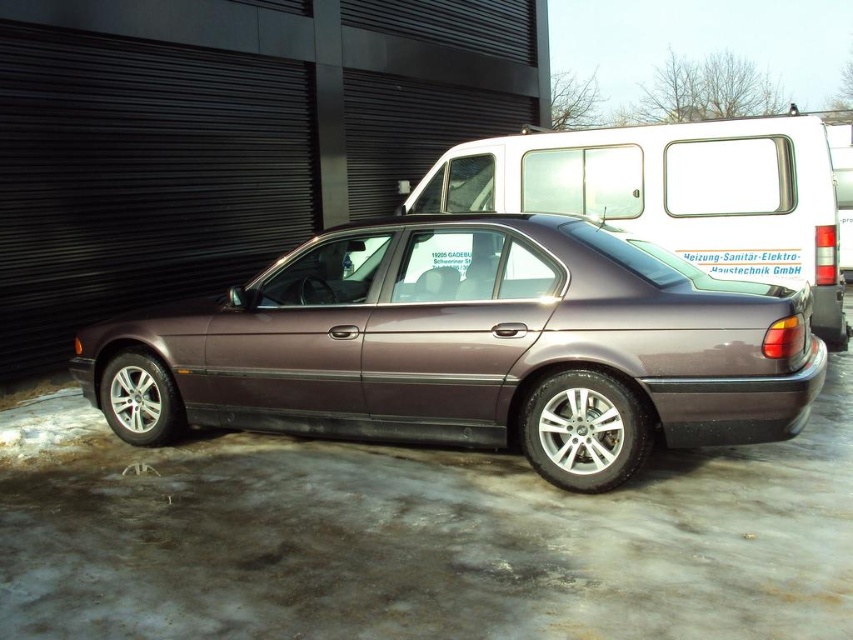
Question: Does satin metallic car at center appear on the left side of metallic silver van at center?

Choices:
 (A) no
 (B) yes

Answer: (B)

Question: Which of the following is the farthest from the observer?

Choices:
 (A) (466, 300)
 (B) (795, 214)

Answer: (B)

Question: Among these points, which one is farthest from the camera?

Choices:
 (A) (672, 164)
 (B) (587, 465)

Answer: (A)

Question: Is satin metallic car at center wider than metallic silver van at center?

Choices:
 (A) no
 (B) yes

Answer: (B)

Question: Which point is farther from the camera taking this photo?

Choices:
 (A) (646, 129)
 (B) (428, 262)

Answer: (A)

Question: Is satin metallic car at center wider than metallic silver van at center?

Choices:
 (A) yes
 (B) no

Answer: (A)